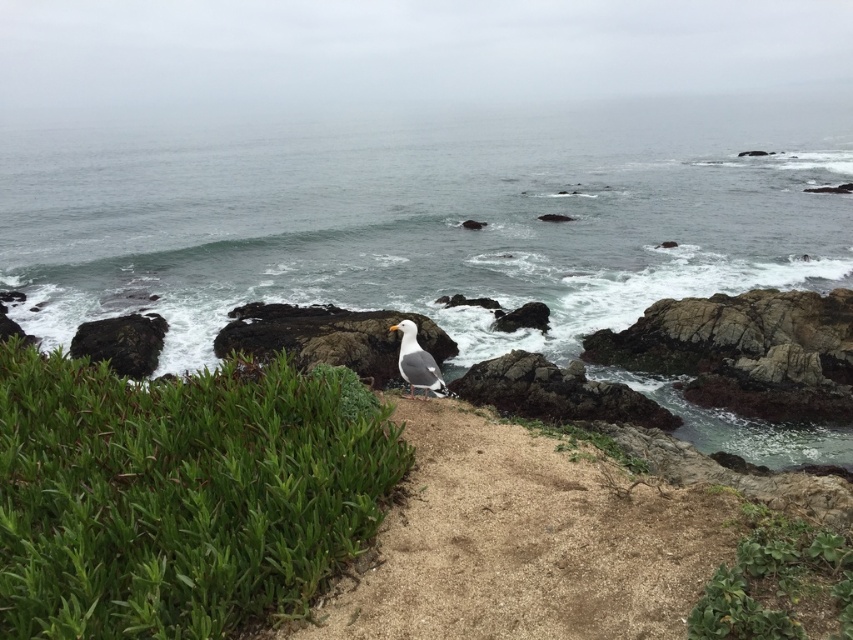
You are standing at the cliff edge and see the clear water at center. Which direction should you move to reach it?

The clear water at center is located at point (424, 218), so you should move towards the center of the image to reach it.

You are standing at the point marked as point (178, 493) and want to walk to the seagull. Which direction should you move to reach the seagull?

The point (178, 493) has a green leafy shrub at center, so you should move away from the green leafy shrub at center towards the rocky outcrop where the seagull is perched.

You are a hiker who wants to take a photo of the green leafy shrub at center and the green leafy plant at lower right. Since you have a camera with a fixed focal length, you need to adjust your position to frame both plants in the shot. Considering their sizes, which plant should you focus on to ensure both are visible in the frame?

The green leafy shrub at center is larger than the green leafy plant at lower right. To include both in the frame, you should position yourself closer to the smaller plant so that the larger shrub and the smaller plant can both fit within the camera view.